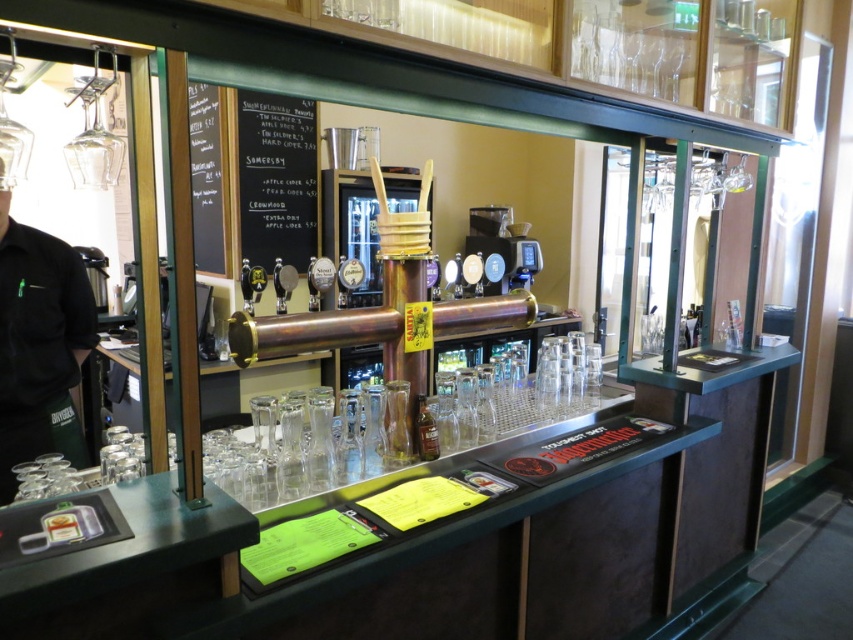
Which is behind, point (54, 353) or point (503, 291)?

Positioned behind is point (503, 291).

Does point (62, 417) come farther from viewer compared to point (503, 257)?

No, it is not.

Where is `black fabric shirt at left`? This screenshot has height=640, width=853. black fabric shirt at left is located at coordinates (38, 342).

Which is in front, point (299, 128) or point (206, 259)?

Point (299, 128) is more forward.

Is black chalkboard at center shorter than black chalkboard at upper left?

Yes.

Image resolution: width=853 pixels, height=640 pixels. In order to click on black chalkboard at center in this screenshot , I will do `click(276, 179)`.

Find the location of a particular element. This screenshot has height=640, width=853. black chalkboard at center is located at coordinates (276, 179).

Can you confirm if black fabric shirt at left is taller than clear glass bottle at center?

Correct, black fabric shirt at left is much taller as clear glass bottle at center.

Which is behind, point (16, 339) or point (419, 396)?

Point (419, 396)

Locate an element on the screen. The image size is (853, 640). black fabric shirt at left is located at coordinates (38, 342).